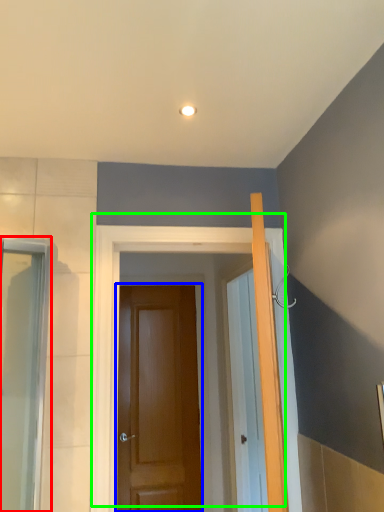
Question: Estimate the real-world distances between objects in this image. Which object is farther from screen door (highlighted by a red box), door (highlighted by a blue box) or door (highlighted by a green box)?

Choices:
 (A) door
 (B) door

Answer: (A)